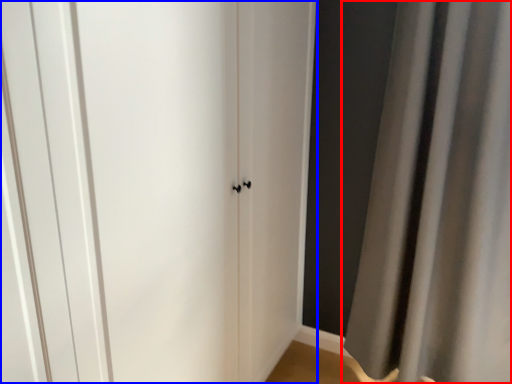
Question: Which point is closer to the camera, curtain (highlighted by a red box) or door (highlighted by a blue box)?

Choices:
 (A) curtain
 (B) door

Answer: (B)